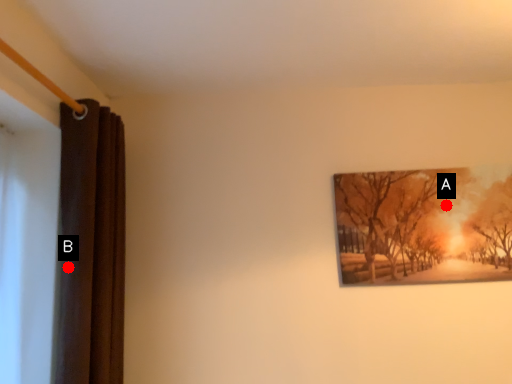
Question: Two points are circled on the image, labeled by A and B beside each circle. Which point is closer to the camera?

Choices:
 (A) A is closer
 (B) B is closer

Answer: (B)